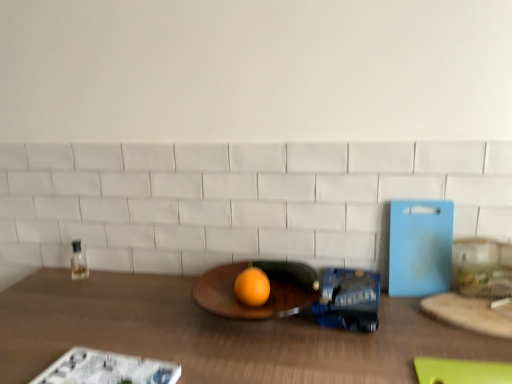
You are a GUI agent. You are given a task and a screenshot of the screen. Output one action in this format:
    pyautogui.click(x=<x>, y=<y>)
    Task: Click on the vacant area that lies in front of orange matte grapefruit at center
    
    Given the screenshot: What is the action you would take?
    pyautogui.click(x=251, y=349)